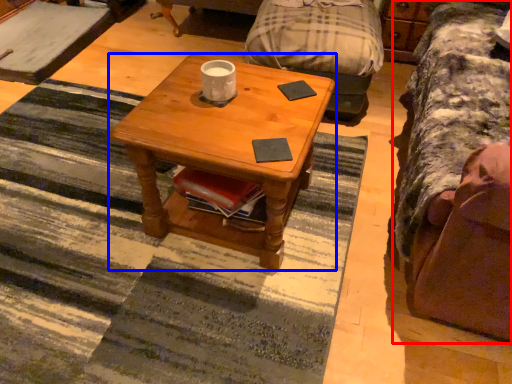
Question: Among these objects, which one is nearest to the camera, studio couch (highlighted by a red box) or coffee table (highlighted by a blue box)?

Choices:
 (A) studio couch
 (B) coffee table

Answer: (A)